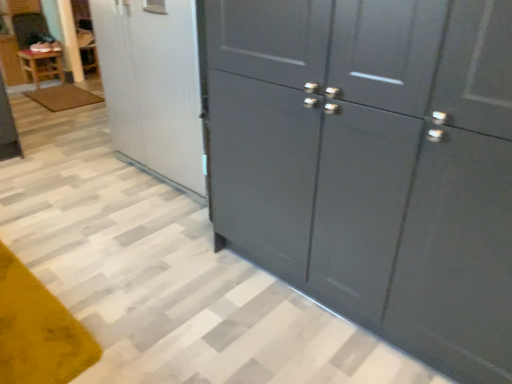
Question: Is glossy dark gray cupboard at right at the back of white glossy refrigerator at upper left?

Choices:
 (A) yes
 (B) no

Answer: (B)

Question: Is white glossy refrigerator at upper left taller than glossy dark gray cupboard at right?

Choices:
 (A) yes
 (B) no

Answer: (B)

Question: Can you confirm if white glossy refrigerator at upper left is wider than glossy dark gray cupboard at right?

Choices:
 (A) no
 (B) yes

Answer: (B)

Question: Is there a large distance between white glossy refrigerator at upper left and glossy dark gray cupboard at right?

Choices:
 (A) no
 (B) yes

Answer: (A)

Question: Does white glossy refrigerator at upper left come in front of glossy dark gray cupboard at right?

Choices:
 (A) yes
 (B) no

Answer: (B)

Question: From the image's perspective, does white glossy refrigerator at upper left appear lower than glossy dark gray cupboard at right?

Choices:
 (A) yes
 (B) no

Answer: (B)

Question: Is brown textured mat at lower left completely or partially outside of white glossy refrigerator at upper left?

Choices:
 (A) yes
 (B) no

Answer: (A)

Question: Does brown textured mat at lower left appear on the right side of white glossy refrigerator at upper left?

Choices:
 (A) yes
 (B) no

Answer: (B)

Question: Is brown textured mat at lower left closer to the viewer compared to white glossy refrigerator at upper left?

Choices:
 (A) yes
 (B) no

Answer: (B)

Question: Considering the relative sizes of brown textured mat at lower left and white glossy refrigerator at upper left in the image provided, is brown textured mat at lower left smaller than white glossy refrigerator at upper left?

Choices:
 (A) yes
 (B) no

Answer: (A)

Question: Is brown textured mat at lower left taller than white glossy refrigerator at upper left?

Choices:
 (A) yes
 (B) no

Answer: (B)

Question: Could you tell me if brown textured mat at lower left is turned towards white glossy refrigerator at upper left?

Choices:
 (A) no
 (B) yes

Answer: (B)

Question: Considering the relative sizes of glossy dark gray cupboard at right and white glossy refrigerator at upper left in the image provided, is glossy dark gray cupboard at right wider than white glossy refrigerator at upper left?

Choices:
 (A) yes
 (B) no

Answer: (B)